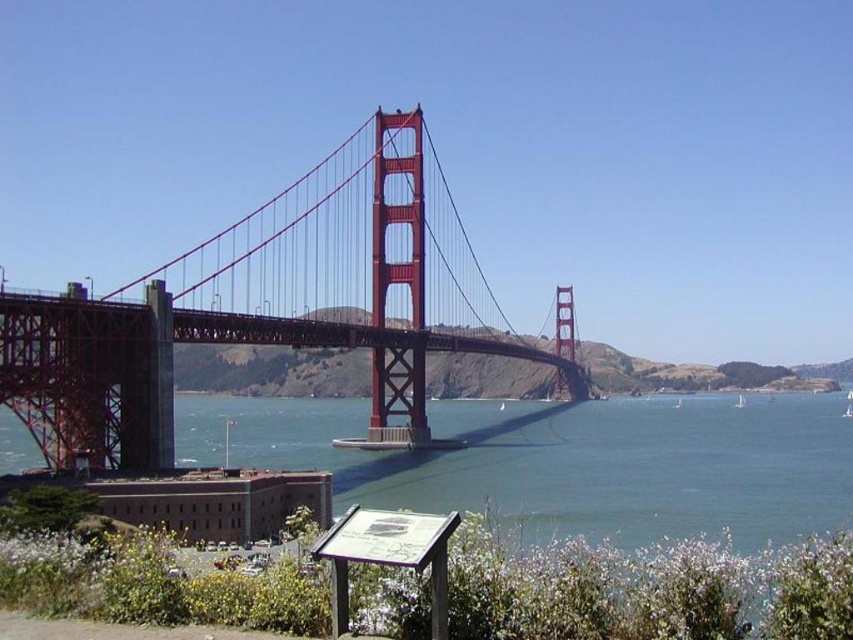
Based on the photo, you are standing at the camera position and want to take a photo of the painted steel bridge at center. If your camera has a maximum focus range of 250 feet, will it be able to focus on the bridge?

The painted steel bridge at center and camera are 249.62 feet apart, which is within the camera maximum focus range of 250 feet. So yes, the camera can focus on the painted steel bridge at center.

You are standing at the observation deck of the Golden Gate Bridge and see the point marked at coordinate (267, 308). What is located at that point?

The point at coordinate (267, 308) indicates the painted steel bridge at center.